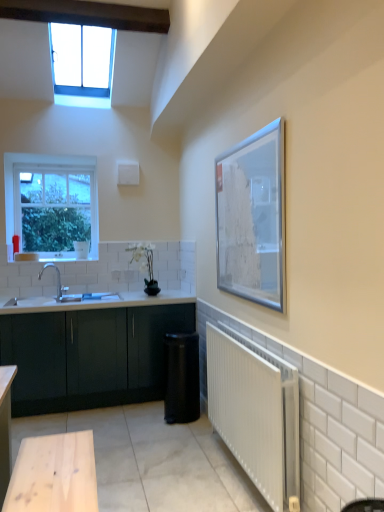
Question: From a real-world perspective, is clear glass window at upper left, the 1th window in the top-to-bottom sequence, located higher than matte dark green cabinet at lower left?

Choices:
 (A) yes
 (B) no

Answer: (A)

Question: Does clear glass window at upper left, marked as the 2th window in a bottom-to-top arrangement, have a greater height compared to matte dark green cabinet at lower left?

Choices:
 (A) yes
 (B) no

Answer: (B)

Question: Can you see clear glass window at upper left, the 1th window when ordered from front to back, touching matte dark green cabinet at lower left?

Choices:
 (A) no
 (B) yes

Answer: (A)

Question: Is clear glass window at upper left, the 1th window when ordered from front to back, bigger than matte dark green cabinet at lower left?

Choices:
 (A) no
 (B) yes

Answer: (A)

Question: Can you confirm if clear glass window at upper left, the second window positioned from the back, is positioned to the left of matte dark green cabinet at lower left?

Choices:
 (A) yes
 (B) no

Answer: (A)

Question: Does clear glass window at upper left, the 1th window in the top-to-bottom sequence, lie behind matte dark green cabinet at lower left?

Choices:
 (A) no
 (B) yes

Answer: (A)

Question: Is clear glass window at upper left, the 1th window viewed from the back, directly adjacent to matte dark green cabinet at lower left?

Choices:
 (A) yes
 (B) no

Answer: (B)

Question: Does clear glass window at upper left, the 1th window from the bottom, appear on the left side of matte dark green cabinet at lower left?

Choices:
 (A) no
 (B) yes

Answer: (B)

Question: From the image's perspective, is clear glass window at upper left, which is counted as the second window, starting from the front, under matte dark green cabinet at lower left?

Choices:
 (A) yes
 (B) no

Answer: (B)

Question: Does clear glass window at upper left, which is the second window in top-to-bottom order, have a greater width compared to matte dark green cabinet at lower left?

Choices:
 (A) yes
 (B) no

Answer: (B)

Question: From a real-world perspective, is clear glass window at upper left, which is counted as the second window, starting from the front, below matte dark green cabinet at lower left?

Choices:
 (A) no
 (B) yes

Answer: (A)

Question: Is clear glass window at upper left, the 1th window from the bottom, further to the viewer compared to matte dark green cabinet at lower left?

Choices:
 (A) no
 (B) yes

Answer: (B)

Question: Is silver metallic picture frame at upper right positioned behind white metallic radiator at lower right?

Choices:
 (A) no
 (B) yes

Answer: (B)